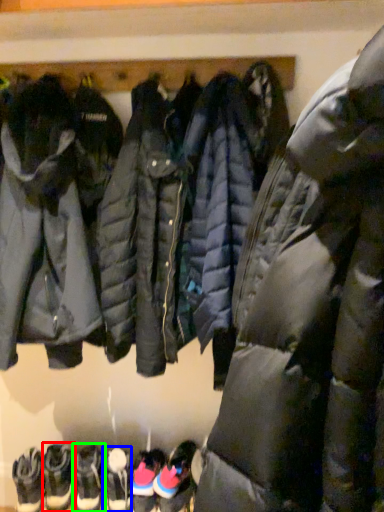
Question: Which object is the farthest from footwear (highlighted by a red box)? Choose among these: footwear (highlighted by a blue box) or footwear (highlighted by a green box).

Choices:
 (A) footwear
 (B) footwear

Answer: (A)